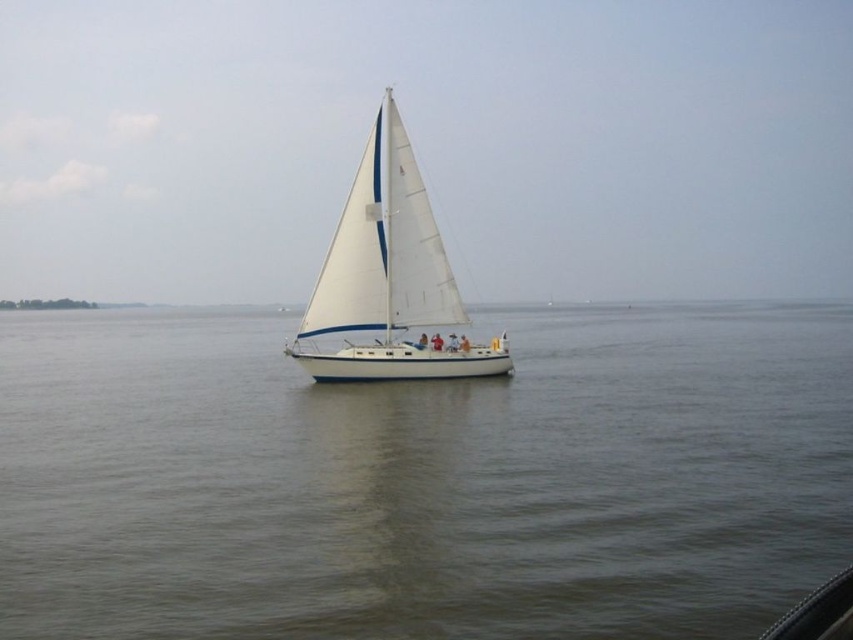
Question: Which point is closer to the camera taking this photo?

Choices:
 (A) (190, 467)
 (B) (338, 234)

Answer: (A)

Question: Is gray water at center to the left of white matte sailboat at center from the viewer's perspective?

Choices:
 (A) yes
 (B) no

Answer: (A)

Question: Does gray water at center appear over white matte sailboat at center?

Choices:
 (A) yes
 (B) no

Answer: (B)

Question: In this image, where is gray water at center located relative to white matte sailboat at center?

Choices:
 (A) right
 (B) left

Answer: (B)

Question: Among these points, which one is nearest to the camera?

Choices:
 (A) (297, 417)
 (B) (395, 292)

Answer: (A)